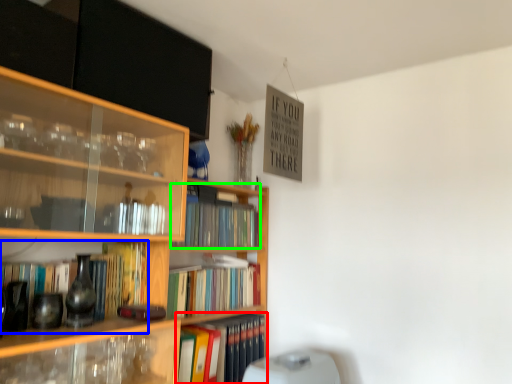
Question: Considering the real-world distances, which object is closest to book (highlighted by a red box)? book (highlighted by a blue box) or book (highlighted by a green box).

Choices:
 (A) book
 (B) book

Answer: (B)